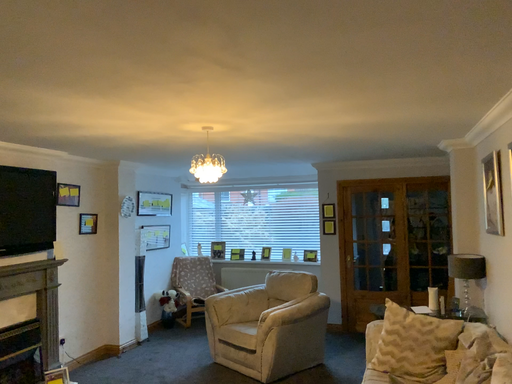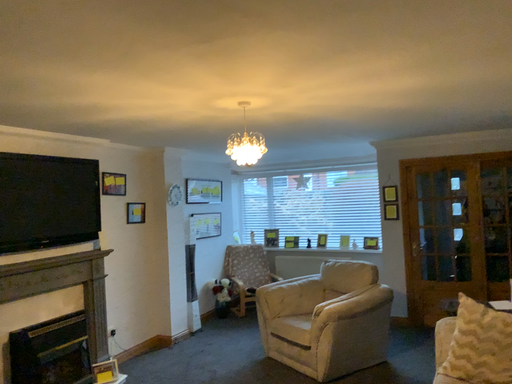
Question: How did the camera likely rotate when shooting the video?

Choices:
 (A) rotated left
 (B) rotated right

Answer: (A)